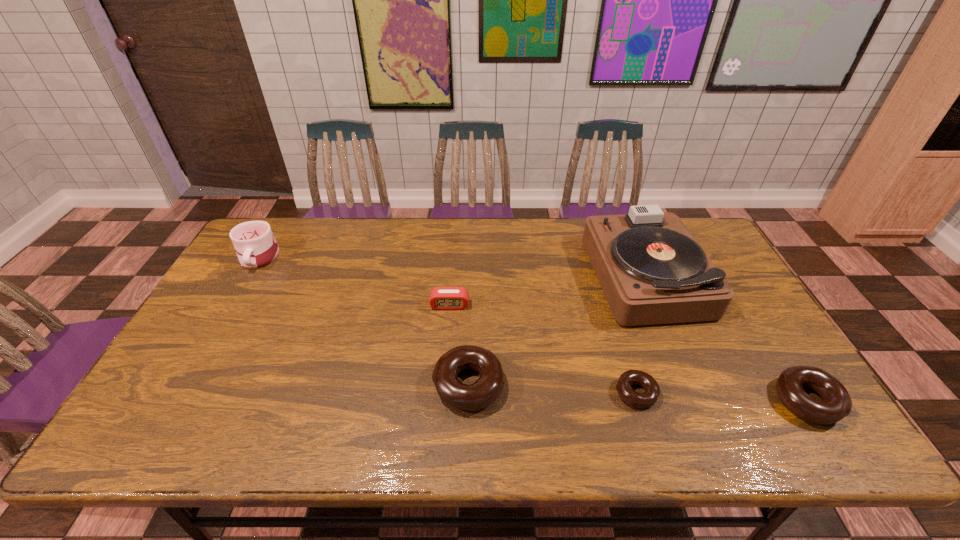
The height and width of the screenshot is (540, 960). I want to click on object that is at the far left corner, so click(256, 247).

Identify the location of object situated at the far right corner. (651, 269).

You are a GUI agent. You are given a task and a screenshot of the screen. Output one action in this format:
    pyautogui.click(x=<x>, y=<y>)
    Task: Click on the object that is positioned at the near right corner
    The image size is (960, 540).
    Given the screenshot: What is the action you would take?
    pyautogui.click(x=836, y=404)

You are a GUI agent. You are given a task and a screenshot of the screen. Output one action in this format:
    pyautogui.click(x=<x>, y=<y>)
    Task: Click on the vacant space at the far edge of the desktop
    The image size is (960, 540).
    Given the screenshot: What is the action you would take?
    pyautogui.click(x=538, y=234)

The image size is (960, 540). Identify the location of vacant space at the near edge of the desktop. (546, 401).

The image size is (960, 540). Find the location of `vacant space at the left edge of the desktop`. vacant space at the left edge of the desktop is located at coordinates (213, 325).

Image resolution: width=960 pixels, height=540 pixels. Find the location of `free space at the right edge of the desktop`. free space at the right edge of the desktop is located at coordinates (734, 297).

Identify the location of empty space that is in between the rightmost object and the second doughnut from right to left. The image size is (960, 540). (722, 397).

This screenshot has width=960, height=540. Find the location of `vacant space that is in between the shortest doughnut and the leftmost doughnut`. vacant space that is in between the shortest doughnut and the leftmost doughnut is located at coordinates (552, 389).

Where is `empty location between the leftmost doughnut and the shortest doughnut`? empty location between the leftmost doughnut and the shortest doughnut is located at coordinates tap(552, 389).